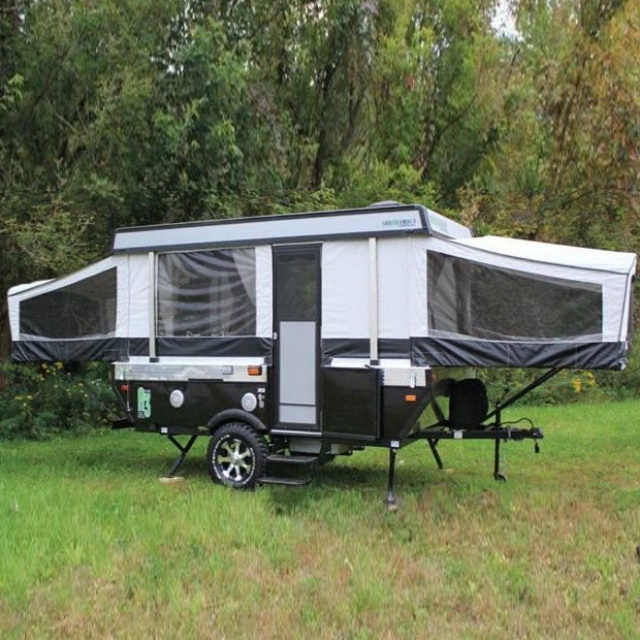
You are planning to set up a small tent in the green grass at center. Considering the presence of the black metallic wheel at lower center, which area would be more suitable for placing the tent?

The green grass at center is thinner than the black metallic wheel at lower center, so the black metallic wheel at lower center is more suitable for placing the tent.